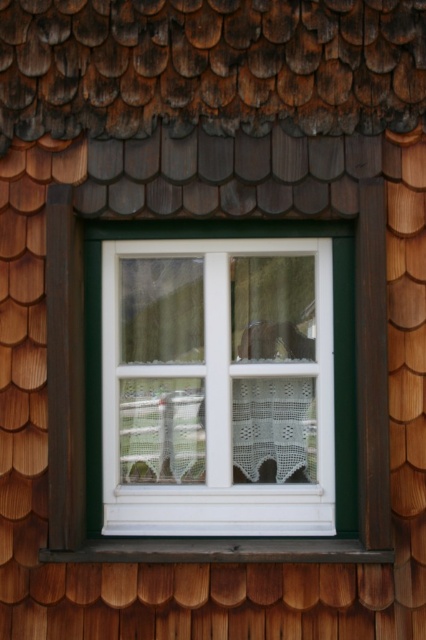
You are a painter who needs to apply a protective coating to the white plastic window at center and the dark wood at bottom. The spray can you have can cover a distance of 18 inches. Will you be able to spray both objects without moving the ladder?

The white plastic window at center and dark wood at bottom are 17.58 inches apart from each other. Since the spray can covers up to 18 inches, you can spray both objects without moving the ladder as the distance between them is within the spray range.

You are an interior designer assessing the window and its surroundings. Given the white plastic window at center and the dark wood at bottom, which object occupies a greater area in the image?

The white plastic window at center is larger in size than the dark wood at bottom, so it occupies a greater area in the image.

You are standing in front of a building and notice the white plastic window at center and the dark wood at bottom. According to the scene, which object is positioned to the right side?

The white plastic window at center is to the right of dark wood at bottom.